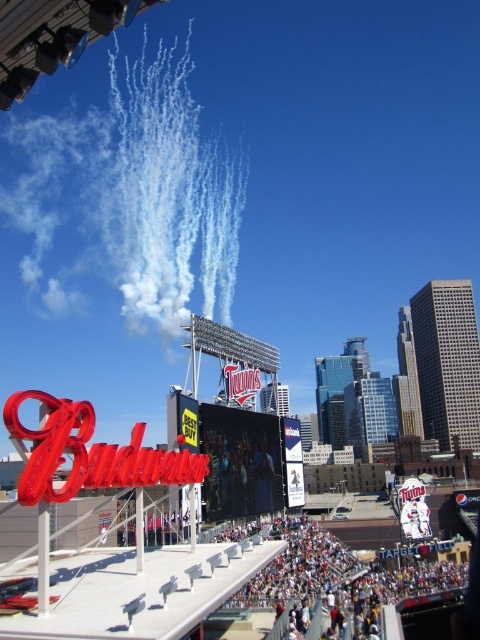
Question: Which point is closer to the camera?

Choices:
 (A) (247, 596)
 (B) (163, 220)

Answer: (A)

Question: Observing the image, what is the correct spatial positioning of white vapor trails at upper center in reference to white cotton crowd at lower center?

Choices:
 (A) left
 (B) right

Answer: (A)

Question: Is white vapor trails at upper center wider than white cotton crowd at lower center?

Choices:
 (A) no
 (B) yes

Answer: (B)

Question: Considering the relative positions of white vapor trails at upper center and white cotton crowd at lower center in the image provided, where is white vapor trails at upper center located with respect to white cotton crowd at lower center?

Choices:
 (A) above
 (B) below

Answer: (A)

Question: Which point is farther from the camera taking this photo?

Choices:
 (A) (156, 147)
 (B) (394, 616)

Answer: (A)